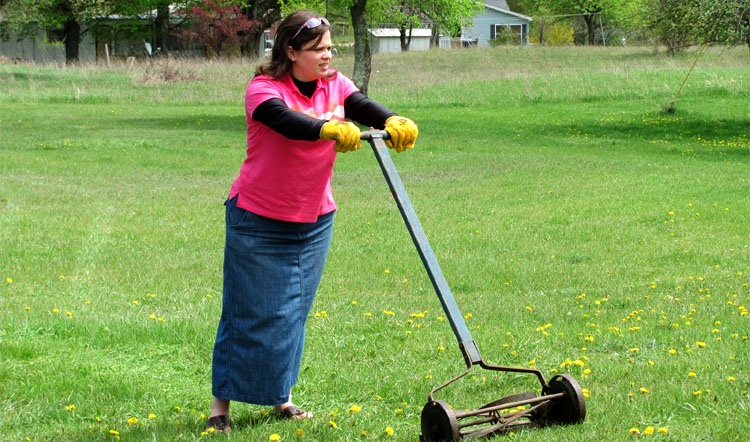
This screenshot has width=750, height=442. What are the coordinates of `handle` in the screenshot? It's located at (375, 130).